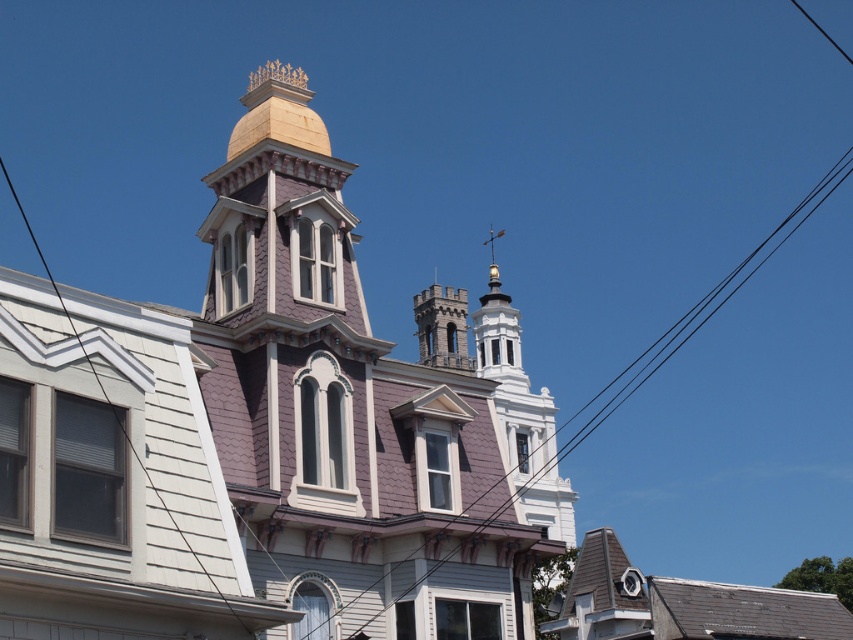
Question: Does purple shingles at center have a greater width compared to gray stone tower at center?

Choices:
 (A) no
 (B) yes

Answer: (B)

Question: Which point is closer to the camera taking this photo?

Choices:
 (A) (433, 294)
 (B) (318, 321)

Answer: (B)

Question: Which of the following is the closest to the observer?

Choices:
 (A) [299, 472]
 (B) [444, 337]

Answer: (A)

Question: Does purple shingles at center appear on the right side of gray stone tower at center?

Choices:
 (A) yes
 (B) no

Answer: (A)

Question: Can you confirm if purple shingles at center is thinner than gray stone tower at center?

Choices:
 (A) yes
 (B) no

Answer: (B)